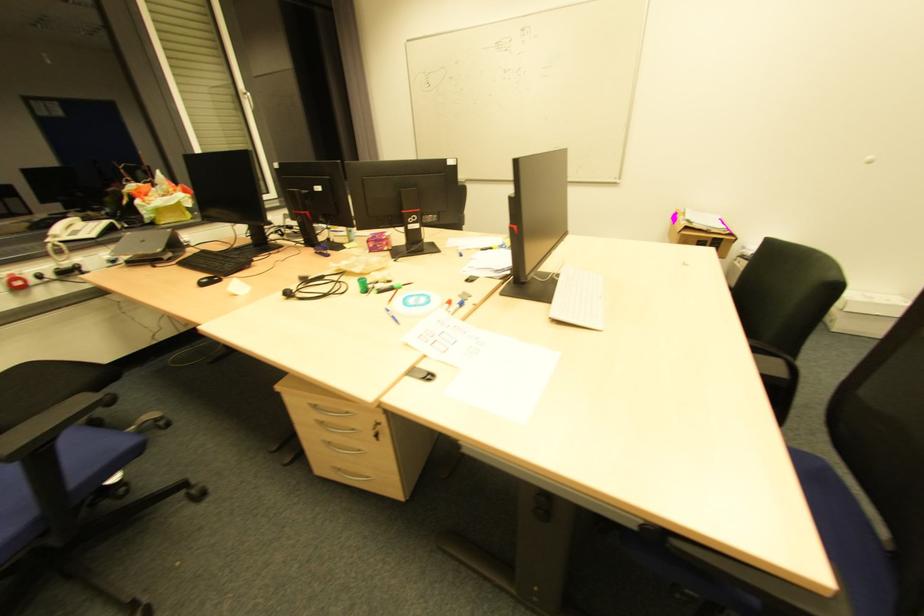
Locate an element on the screen. The width and height of the screenshot is (924, 616). green marker cap is located at coordinates (362, 285).